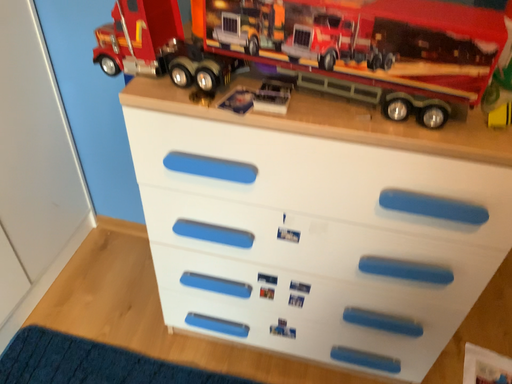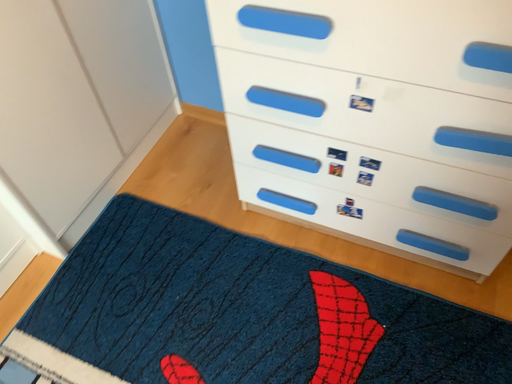
Question: How did the camera likely rotate when shooting the video?

Choices:
 (A) rotated upward
 (B) rotated downward

Answer: (B)